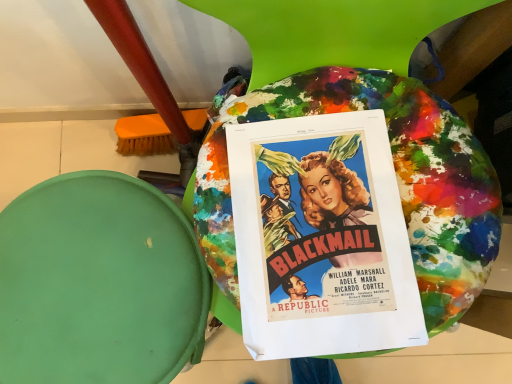
Based on the photo, what is the approximate width of vibrant paper poster at center?

vibrant paper poster at center is 12.13 inches wide.

You are a GUI agent. You are given a task and a screenshot of the screen. Output one action in this format:
    pyautogui.click(x=<x>, y=<y>)
    Task: Click on the vibrant paper poster at center
    This screenshot has width=512, height=384.
    Given the screenshot: What is the action you would take?
    pyautogui.click(x=322, y=238)

The image size is (512, 384). Describe the element at coordinates (322, 238) in the screenshot. I see `vibrant paper poster at center` at that location.

What is the approximate height of paint splattered fabric bean bag at center?

19.01 inches.

What do you see at coordinates (99, 283) in the screenshot?
I see `paint splattered fabric bean bag at center` at bounding box center [99, 283].

Measure the distance between paint splattered fabric bean bag at center and camera.

paint splattered fabric bean bag at center is 21.01 inches from camera.

Where is `paint splattered fabric bean bag at center`? This screenshot has height=384, width=512. paint splattered fabric bean bag at center is located at coordinates (99, 283).

What are the coordinates of `vibrant paper poster at center` in the screenshot? It's located at (322, 238).

Can you confirm if paint splattered fabric bean bag at center is positioned to the left of vibrant paper poster at center?

Yes, paint splattered fabric bean bag at center is to the left of vibrant paper poster at center.

Consider the image. Which object is closer to the camera taking this photo, paint splattered fabric bean bag at center or vibrant paper poster at center?

Positioned in front is vibrant paper poster at center.

Which is farther from the camera, (143, 372) or (341, 186)?

The point (341, 186) is behind.

From the image's perspective, between paint splattered fabric bean bag at center and vibrant paper poster at center, which one is located above?

From the image's view, vibrant paper poster at center is above.

From a real-world perspective, is paint splattered fabric bean bag at center located beneath vibrant paper poster at center?

Yes.

Considering the relative sizes of paint splattered fabric bean bag at center and vibrant paper poster at center in the image provided, is paint splattered fabric bean bag at center wider than vibrant paper poster at center?

Indeed, paint splattered fabric bean bag at center has a greater width compared to vibrant paper poster at center.

Considering the relative sizes of paint splattered fabric bean bag at center and vibrant paper poster at center in the image provided, is paint splattered fabric bean bag at center shorter than vibrant paper poster at center?

No, paint splattered fabric bean bag at center is not shorter than vibrant paper poster at center.

Between paint splattered fabric bean bag at center and vibrant paper poster at center, which one has larger size?

Bigger between the two is paint splattered fabric bean bag at center.

Choose the correct answer: Is paint splattered fabric bean bag at center inside vibrant paper poster at center or outside it?

paint splattered fabric bean bag at center lies outside vibrant paper poster at center.

Can you see paint splattered fabric bean bag at center touching vibrant paper poster at center?

No, paint splattered fabric bean bag at center is not beside vibrant paper poster at center.

Is paint splattered fabric bean bag at center facing towards vibrant paper poster at center?

No, paint splattered fabric bean bag at center is not oriented towards vibrant paper poster at center.

Locate an element on the screen. The width and height of the screenshot is (512, 384). poster on the right of paint splattered fabric bean bag at center is located at coordinates (322, 238).

Between vibrant paper poster at center and paint splattered fabric bean bag at center, which one appears on the left side from the viewer's perspective?

paint splattered fabric bean bag at center is more to the left.

Is vibrant paper poster at center further to camera compared to paint splattered fabric bean bag at center?

No, the depth of vibrant paper poster at center is less than that of paint splattered fabric bean bag at center.

Does point (336, 136) come closer to viewer compared to point (70, 289)?

That is False.

In the scene shown: From the image's perspective, does vibrant paper poster at center appear lower than paint splattered fabric bean bag at center?

No, from the image's perspective, vibrant paper poster at center is not beneath paint splattered fabric bean bag at center.

From a real-world perspective, is vibrant paper poster at center located higher than paint splattered fabric bean bag at center?

Yes, from a real-world perspective, vibrant paper poster at center is over paint splattered fabric bean bag at center

Considering the sizes of objects vibrant paper poster at center and paint splattered fabric bean bag at center in the image provided, who is wider, vibrant paper poster at center or paint splattered fabric bean bag at center?

Wider between the two is paint splattered fabric bean bag at center.

Between vibrant paper poster at center and paint splattered fabric bean bag at center, which one has more height?

With more height is paint splattered fabric bean bag at center.

Is vibrant paper poster at center bigger or smaller than paint splattered fabric bean bag at center?

In the image, vibrant paper poster at center appears to be smaller than paint splattered fabric bean bag at center.

Is vibrant paper poster at center surrounding paint splattered fabric bean bag at center?

No, paint splattered fabric bean bag at center is not a part of vibrant paper poster at center.

Is the surface of vibrant paper poster at center in direct contact with paint splattered fabric bean bag at center?

There is a gap between vibrant paper poster at center and paint splattered fabric bean bag at center.

Is vibrant paper poster at center positioned with its back to paint splattered fabric bean bag at center?

That's not correct — vibrant paper poster at center is not looking away from paint splattered fabric bean bag at center.

What's the angular difference between vibrant paper poster at center and paint splattered fabric bean bag at center's facing directions?

The facing directions of vibrant paper poster at center and paint splattered fabric bean bag at center are 3.41 degrees apart.

Identify the location of poster in front of the paint splattered fabric bean bag at center. (322, 238).

This screenshot has height=384, width=512. I want to click on bean bag chair behind the vibrant paper poster at center, so click(99, 283).

At what (x,y) coordinates should I click in order to perform the action: click on poster located in front of the paint splattered fabric bean bag at center. Please return your answer as a coordinate pair (x, y). Image resolution: width=512 pixels, height=384 pixels. Looking at the image, I should click on (322, 238).